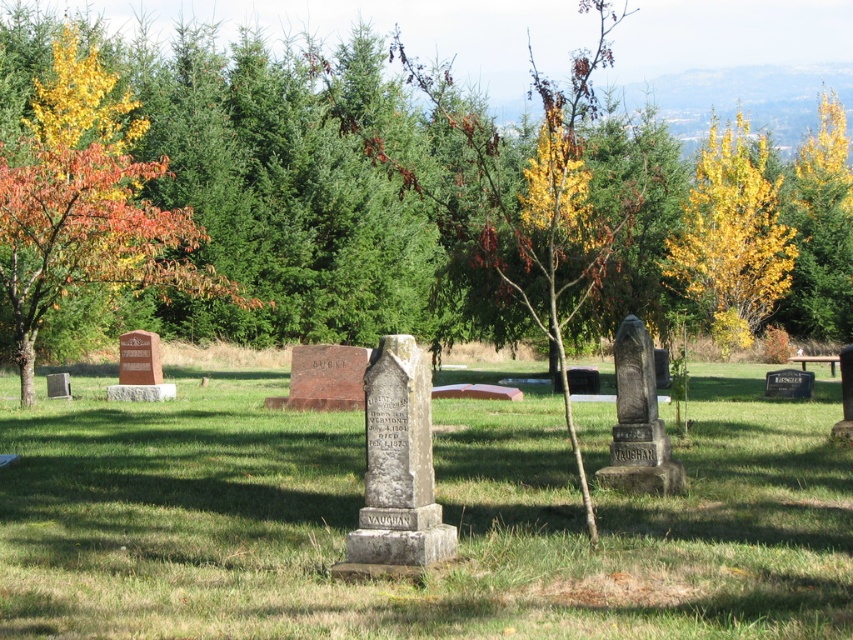
You are a gardener planning to plant new flowers in the cemetery. You want to choose between the green grass at center and the orange leafy tree at left for the flower bed location. Based on the space available, which area would allow for a larger flower bed?

The orange leafy tree at left occupies more space than the green grass at center, so the area around the orange leafy tree at left would allow for a larger flower bed.

You are standing in the cemetery and want to place a small bouquet of flowers between the green grass at center and the orange leafy tree at left. Which object should you place the bouquet closer to if you want it to be more visible from where you are standing?

The green grass at center is closer to the viewer than the orange leafy tree at left, so placing the bouquet near the green grass at center would make it more visible from your current position.

You are standing in the cemetery and want to place a small flower at the point closer to you between point [194,28] and point [82,253]. Which point should you go to?

Point [194,28] is further to the camera than point [82,253], so the closer point is point [82,253]. You should go to point [82,253] to place the flower.